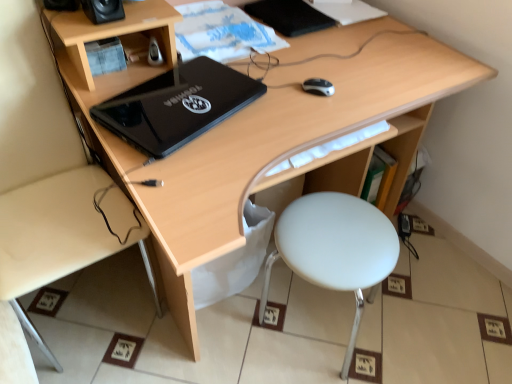
Question: From the image's perspective, would you say light wood desk at lower left is positioned over black plastic speaker at upper left, which is the first speaker from left to right?

Choices:
 (A) yes
 (B) no

Answer: (B)

Question: Does light wood desk at lower left have a lesser height compared to black plastic speaker at upper left, the 2th speaker from the right?

Choices:
 (A) yes
 (B) no

Answer: (B)

Question: Can you confirm if light wood desk at lower left is smaller than black plastic speaker at upper left, which is the first speaker from left to right?

Choices:
 (A) no
 (B) yes

Answer: (A)

Question: Is light wood desk at lower left outside black plastic speaker at upper left, which is the first speaker from left to right?

Choices:
 (A) yes
 (B) no

Answer: (A)

Question: Is light wood desk at lower left oriented away from black plastic speaker at upper left, the 2th speaker from the right?

Choices:
 (A) no
 (B) yes

Answer: (A)

Question: From their relative heights in the image, would you say white plastic stool at lower right is taller or shorter than black matte notebook at upper center?

Choices:
 (A) short
 (B) tall

Answer: (B)

Question: From the image's perspective, is white plastic stool at lower right above or below black matte notebook at upper center?

Choices:
 (A) below
 (B) above

Answer: (A)

Question: In terms of width, does white plastic stool at lower right look wider or thinner when compared to black matte notebook at upper center?

Choices:
 (A) thin
 (B) wide

Answer: (B)

Question: From a real-world perspective, relative to black matte notebook at upper center, is white plastic stool at lower right vertically above or below?

Choices:
 (A) above
 (B) below

Answer: (B)

Question: In the image, is black plastic mouse at center positioned in front of or behind black plastic speaker at upper left, the 2th speaker from the right?

Choices:
 (A) behind
 (B) front

Answer: (A)

Question: From a real-world perspective, is black plastic mouse at center above or below black plastic speaker at upper left, the 2th speaker from the right?

Choices:
 (A) below
 (B) above

Answer: (A)

Question: Is black plastic mouse at center situated inside black plastic speaker at upper left, which is the first speaker from left to right, or outside?

Choices:
 (A) outside
 (B) inside

Answer: (A)

Question: In the image, is black plastic mouse at center on the left side or the right side of black plastic speaker at upper left, the 2th speaker from the right?

Choices:
 (A) right
 (B) left

Answer: (A)

Question: Do you think black plastic speaker at upper left, the 2th speaker from the right, is within black plastic mouse at center, or outside of it?

Choices:
 (A) inside
 (B) outside

Answer: (B)

Question: Visually, is black plastic speaker at upper left, which is the first speaker from left to right, positioned to the left or to the right of black plastic mouse at center?

Choices:
 (A) left
 (B) right

Answer: (A)